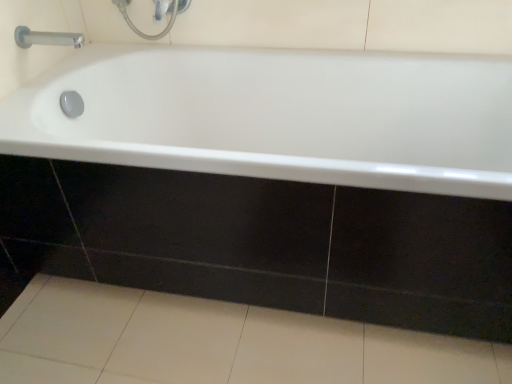
Question: Does white glossy bathtub at center have a greater width compared to satin chrome faucet at upper left?

Choices:
 (A) yes
 (B) no

Answer: (A)

Question: Is white glossy bathtub at center oriented away from satin chrome faucet at upper left?

Choices:
 (A) yes
 (B) no

Answer: (B)

Question: From the image's perspective, does white glossy bathtub at center appear lower than satin chrome faucet at upper left?

Choices:
 (A) yes
 (B) no

Answer: (A)

Question: Is white glossy bathtub at center not within satin chrome faucet at upper left?

Choices:
 (A) yes
 (B) no

Answer: (A)

Question: Is white glossy bathtub at center placed right next to satin chrome faucet at upper left?

Choices:
 (A) yes
 (B) no

Answer: (B)

Question: Is point (36, 279) closer or farther from the camera than point (165, 102)?

Choices:
 (A) closer
 (B) farther

Answer: (A)

Question: Is white glossy tile at lower center taller or shorter than white glossy bathtub at center?

Choices:
 (A) tall
 (B) short

Answer: (B)

Question: From the image's perspective, is white glossy tile at lower center positioned above or below white glossy bathtub at center?

Choices:
 (A) below
 (B) above

Answer: (A)

Question: From a real-world perspective, is white glossy tile at lower center physically located above or below white glossy bathtub at center?

Choices:
 (A) below
 (B) above

Answer: (A)

Question: Relative to white glossy tile at lower center, is satin chrome faucet at upper left in front or behind?

Choices:
 (A) front
 (B) behind

Answer: (B)

Question: In terms of size, does satin chrome faucet at upper left appear bigger or smaller than white glossy tile at lower center?

Choices:
 (A) small
 (B) big

Answer: (A)

Question: Considering the positions of satin chrome faucet at upper left and white glossy tile at lower center in the image, is satin chrome faucet at upper left wider or thinner than white glossy tile at lower center?

Choices:
 (A) wide
 (B) thin

Answer: (B)

Question: From the image's perspective, is satin chrome faucet at upper left located above or below white glossy tile at lower center?

Choices:
 (A) below
 (B) above

Answer: (B)

Question: Is satin chrome faucet at upper left situated inside white glossy bathtub at center or outside?

Choices:
 (A) outside
 (B) inside

Answer: (A)

Question: From the image's perspective, is satin chrome faucet at upper left above or below white glossy bathtub at center?

Choices:
 (A) below
 (B) above

Answer: (B)